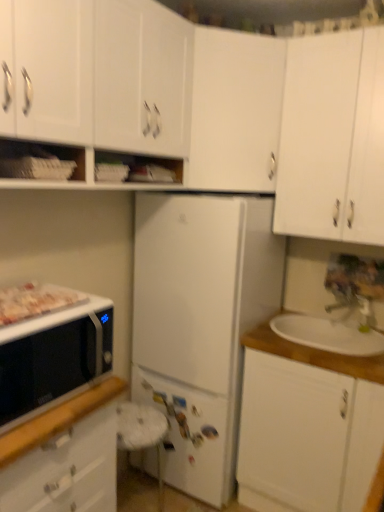
Question: Is point (21, 303) closer or farther from the camera than point (77, 2)?

Choices:
 (A) closer
 (B) farther

Answer: (B)

Question: From a real-world perspective, is white glossy tray at left above or below white matte cabinet at upper left, arranged as the second cabinetry when viewed from the left?

Choices:
 (A) above
 (B) below

Answer: (B)

Question: Estimate the real-world distances between objects in this image. Which object is farther from the white matte cabinet at upper center, which is the 3th cabinetry in left-to-right order?

Choices:
 (A) metallic silver faucet at upper right
 (B) white matte refrigerator at center
 (C) white wood sink at right
 (D) white wood cabinet at right, the 2th cabinetry when ordered from right to left
 (E) white matte cabinet at upper right, marked as the 1th cabinetry in a right-to-left arrangement

Answer: (D)

Question: Which is farther from the white matte cabinet at upper left, arranged as the second cabinetry when viewed from the left?

Choices:
 (A) black matte microwave at left
 (B) white matte microwave at lower left, the 1th cabinetry positioned from the left
 (C) white matte refrigerator at center
 (D) white matte cabinet at upper right, marked as the 1th cabinetry in a right-to-left arrangement
 (E) white glossy tray at left

Answer: (B)